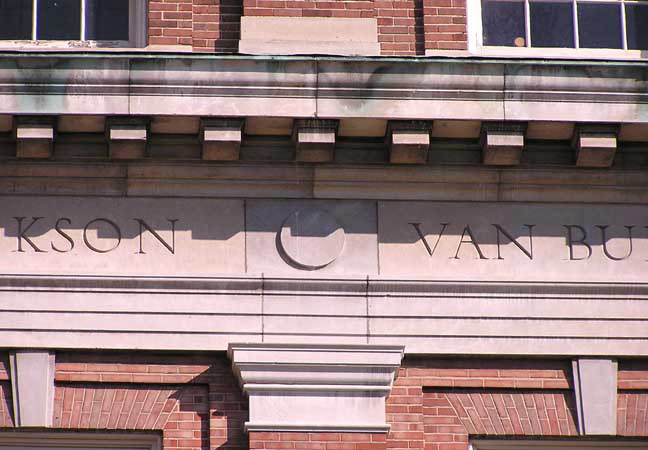
Locate an element on the screen. This screenshot has width=648, height=450. frame around window is located at coordinates (477, 36).